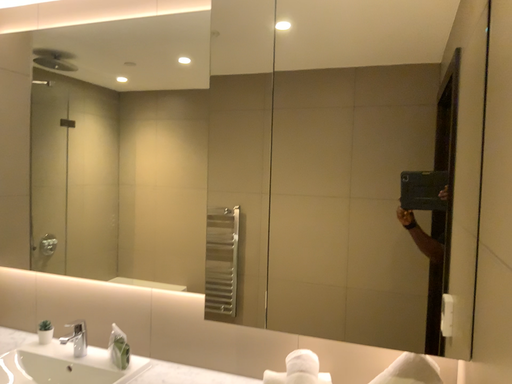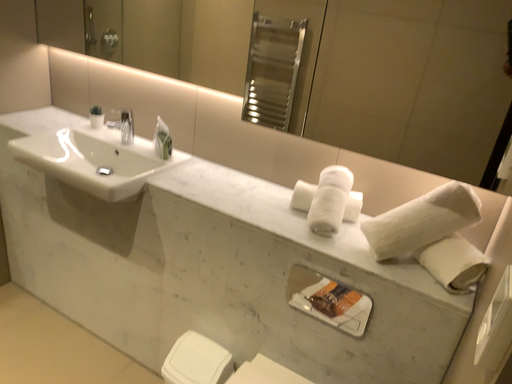
Question: How did the camera likely rotate when shooting the video?

Choices:
 (A) rotated downward
 (B) rotated upward

Answer: (A)